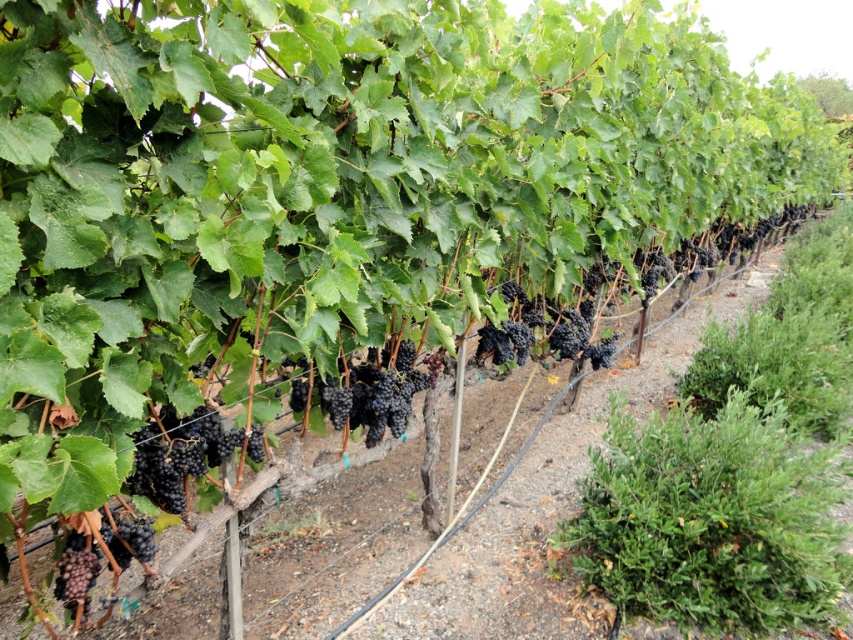
You are a farmer checking the grapevines in the vineyard. You notice the shiny purple grapes at center and the black matte grapes at lower left. Which grape cluster do you think has a greater width?

The shiny purple grapes at center might be wider than black matte grapes at lower left.

You are standing at the origin point of the vineyard, which is at the bottom left corner of the image. You want to walk towards point point [334,387] and point [68,557]. Which point will you reach first?

You will reach point [68,557] first because it is closer to your starting position at the bottom left corner compared to point [334,387], which is further away.

You are a farmer inspecting the vineyard and notice two grape clusters, the shiny dark purple grapes at center and the black matte grapes at lower left. Which grape cluster is positioned higher in the scene?

The shiny dark purple grapes at center is taller than the black matte grapes at lower left, so it is positioned higher in the scene.